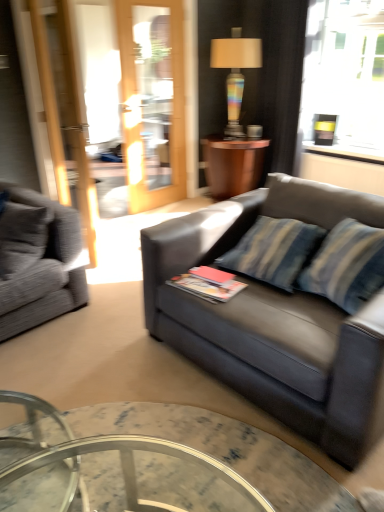
Question: Is rainbow glass lamp at upper center with wooden side table at center?

Choices:
 (A) no
 (B) yes

Answer: (A)

Question: Does rainbow glass lamp at upper center have a lesser height compared to wooden side table at center?

Choices:
 (A) no
 (B) yes

Answer: (A)

Question: Considering the relative positions of rainbow glass lamp at upper center and wooden side table at center in the image provided, is rainbow glass lamp at upper center in front of wooden side table at center?

Choices:
 (A) no
 (B) yes

Answer: (B)

Question: Is rainbow glass lamp at upper center wider than wooden side table at center?

Choices:
 (A) yes
 (B) no

Answer: (B)

Question: Considering the relative sizes of rainbow glass lamp at upper center and wooden side table at center in the image provided, is rainbow glass lamp at upper center thinner than wooden side table at center?

Choices:
 (A) yes
 (B) no

Answer: (A)

Question: Is point (231, 96) closer or farther from the camera than point (188, 408)?

Choices:
 (A) closer
 (B) farther

Answer: (B)

Question: In the image, is rainbow glass lamp at upper center on the left side or the right side of marble glass coffee table at center?

Choices:
 (A) left
 (B) right

Answer: (B)

Question: Considering the positions of rainbow glass lamp at upper center and marble glass coffee table at center in the image, is rainbow glass lamp at upper center wider or thinner than marble glass coffee table at center?

Choices:
 (A) thin
 (B) wide

Answer: (A)

Question: From a real-world perspective, is rainbow glass lamp at upper center positioned above or below marble glass coffee table at center?

Choices:
 (A) below
 (B) above

Answer: (B)

Question: Would you say gray fabric couch at left, the 1th studio couch viewed from the left, is to the left or to the right of marble glass coffee table at center in the picture?

Choices:
 (A) right
 (B) left

Answer: (B)

Question: From the image's perspective, is gray fabric couch at left, the 1th studio couch viewed from the left, above or below marble glass coffee table at center?

Choices:
 (A) below
 (B) above

Answer: (B)

Question: In the image, is gray fabric couch at left, the 1th studio couch viewed from the left, positioned in front of or behind marble glass coffee table at center?

Choices:
 (A) front
 (B) behind

Answer: (B)

Question: Considering the positions of gray fabric couch at left, the 1th studio couch viewed from the left, and marble glass coffee table at center in the image, is gray fabric couch at left, the 1th studio couch viewed from the left, bigger or smaller than marble glass coffee table at center?

Choices:
 (A) small
 (B) big

Answer: (B)

Question: Visually, is marble glass coffee table at center positioned to the left or to the right of rainbow glass lamp at upper center?

Choices:
 (A) left
 (B) right

Answer: (A)

Question: Relative to rainbow glass lamp at upper center, is marble glass coffee table at center in front or behind?

Choices:
 (A) front
 (B) behind

Answer: (A)